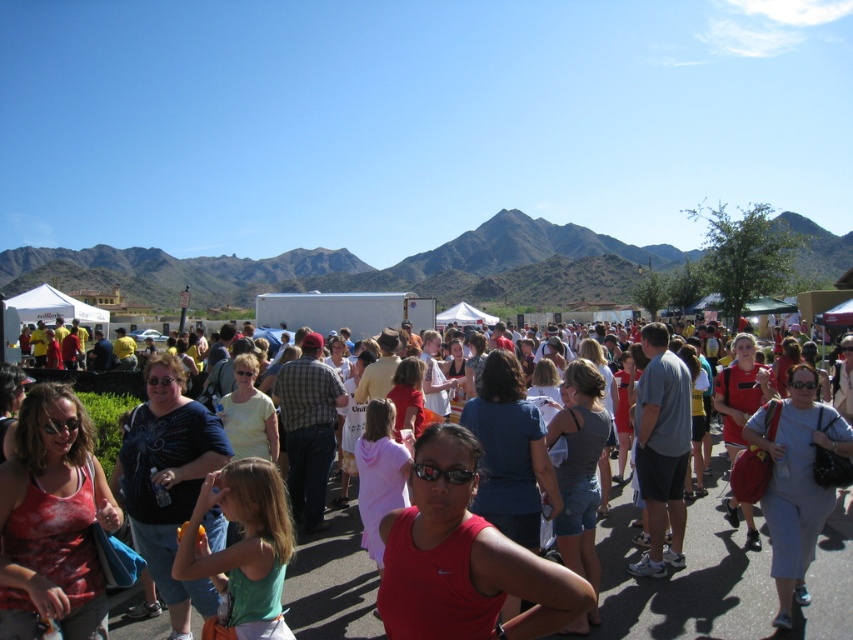
Based on the photo, you are a photographer at the event and want to capture a photo that includes both the green grassy mountain at upper center and the matte red tank top at center. Based on their positions, which object should you focus on first to ensure both are in the frame?

The green grassy mountain at upper center is located above the matte red tank top at center, so you should focus on the matte red tank top at center first to ensure both are in the frame. Since the mountain is above it, adjusting the camera angle downward from the tank top will include both.

You are at the lively outdoor event and want to take a photo of both the point at (663, 269) and the point at (622, 508). Which point should you focus on first to ensure both are in focus?

You should focus on the point at (663, 269) first because it is closer to the camera than the point at (622, 508). This way, both points will be within the depth of field.

You are a photographer at the event and want to capture both the green grassy mountain at upper center and the matte red tank top at center in one frame. Which object will occupy more horizontal space in the photo?

The green grassy mountain at upper center will occupy more horizontal space in the photo because its width is larger than that of the matte red tank top at center.